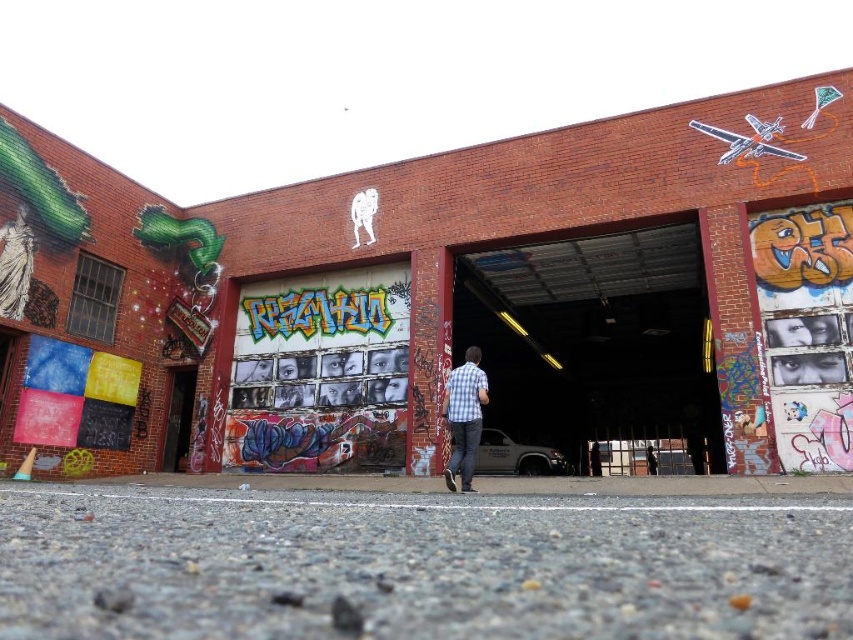
Question: Is gray asphalt at lower center thinner than checkered shirt at center?

Choices:
 (A) no
 (B) yes

Answer: (A)

Question: Which object appears farthest from the camera in this image?

Choices:
 (A) checkered shirt at center
 (B) gray asphalt at lower center

Answer: (A)

Question: Can you confirm if gray asphalt at lower center is positioned above checkered shirt at center?

Choices:
 (A) no
 (B) yes

Answer: (B)

Question: Is gray asphalt at lower center smaller than checkered shirt at center?

Choices:
 (A) yes
 (B) no

Answer: (A)